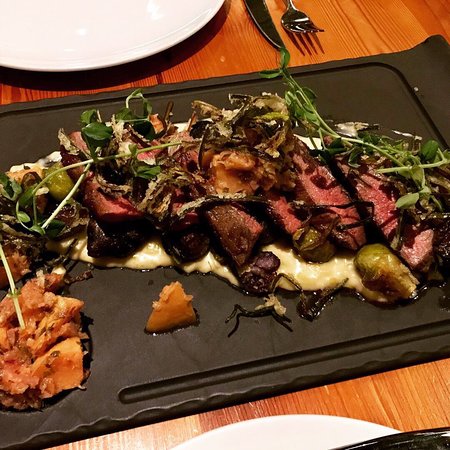
The image size is (450, 450). What are the coordinates of `black wooden tray` in the screenshot? It's located at pos(225,341).